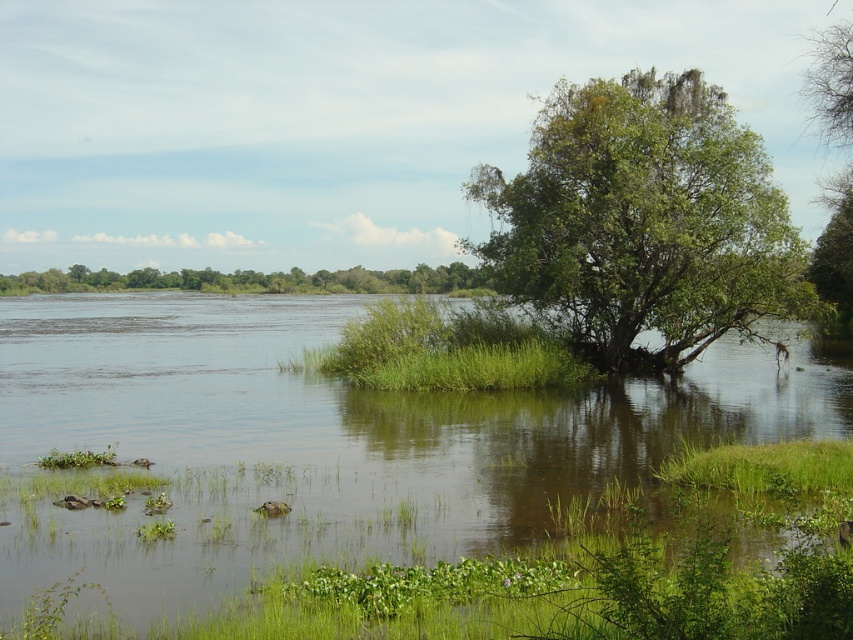
You are a hiker who wants to cross the green grassy river at center to reach the green leafy tree at center. Is the tree accessible from the river?

The green leafy tree at center is located above the green grassy river at center, so the tree is accessible by walking along the river towards it.

You are standing at the edge of the green grassy river at center and looking towards the green leafy tree at center. Which object is nearer to you?

A: The green grassy river at center is closer to the viewer than the green leafy tree at center, so the green grassy river at center is nearer to you.